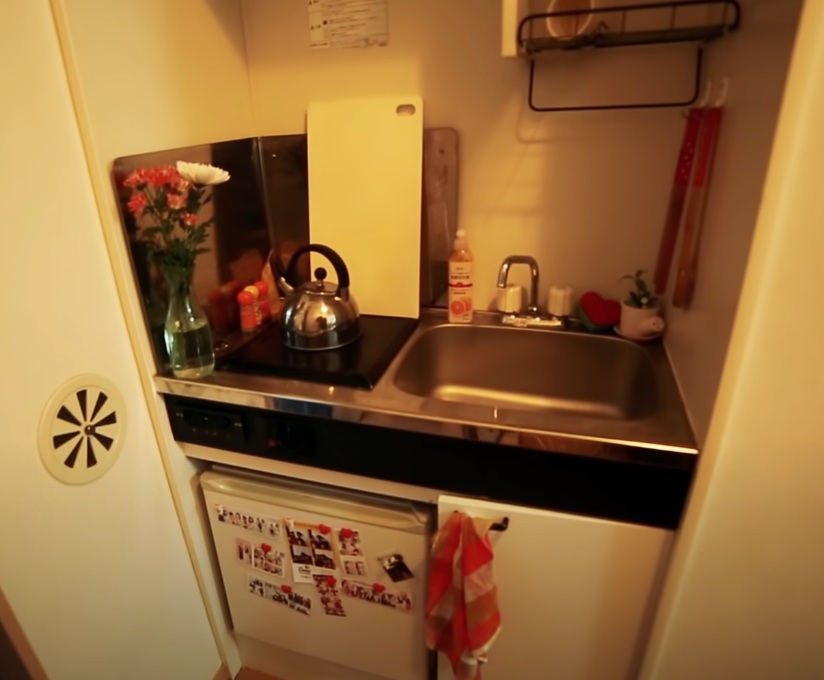
Identify the location of refrigerator. This screenshot has width=824, height=680. (367, 619).